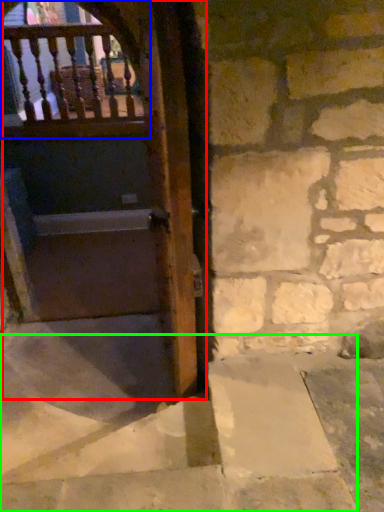
Question: Which object is positioned farthest from door (highlighted by a red box)? Select from balcony (highlighted by a blue box) and stairwell (highlighted by a green box).

Choices:
 (A) balcony
 (B) stairwell

Answer: (B)